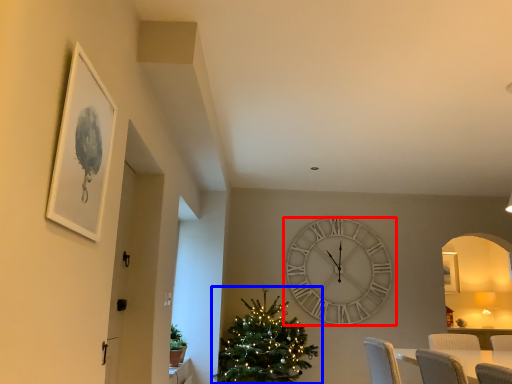
Question: Among these objects, which one is nearest to the camera, wall clock (highlighted by a red box) or christmas tree (highlighted by a blue box)?

Choices:
 (A) wall clock
 (B) christmas tree

Answer: (B)